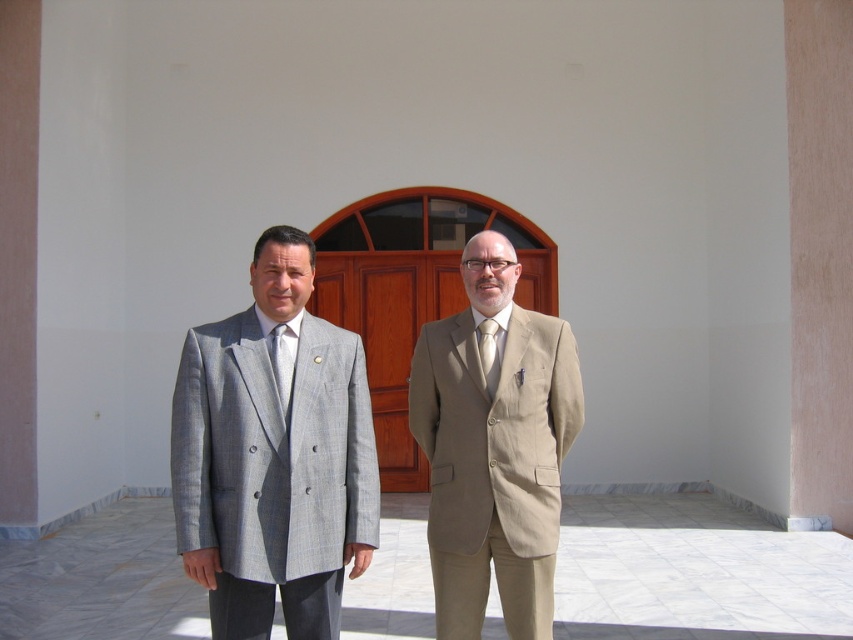
Question: Does gray textured suit at left have a larger size compared to matte white tie at center?

Choices:
 (A) yes
 (B) no

Answer: (A)

Question: Which object is the closest to the matte white tie at center?

Choices:
 (A) matte gray tie at center
 (B) beige fabric suit at center
 (C) gray textured suit at left

Answer: (B)

Question: Estimate the real-world distances between objects in this image. Which object is farther from the matte white tie at center?

Choices:
 (A) matte gray tie at center
 (B) gray textured suit at left

Answer: (B)

Question: Is beige fabric suit at center wider than matte gray tie at center?

Choices:
 (A) no
 (B) yes

Answer: (B)

Question: Is gray textured suit at left closer to camera compared to matte white tie at center?

Choices:
 (A) no
 (B) yes

Answer: (B)

Question: Considering the real-world distances, which object is farthest from the beige fabric suit at center?

Choices:
 (A) matte gray tie at center
 (B) matte white tie at center

Answer: (A)